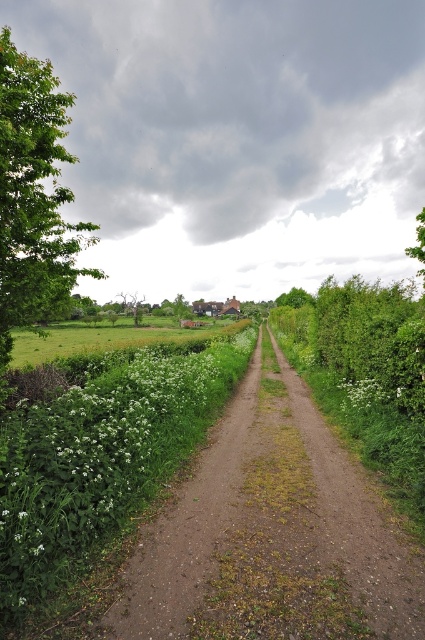
Can you confirm if dirt path at center is taller than white fluffy flower at center?

Yes.

This screenshot has height=640, width=425. What do you see at coordinates (272, 532) in the screenshot? I see `dirt path at center` at bounding box center [272, 532].

Measure the distance between dirt path at center and camera.

dirt path at center and camera are 7.74 meters apart from each other.

Identify the location of dirt path at center. This screenshot has width=425, height=640. (272, 532).

How much distance is there between dirt path at center and green grassy field at center?

A distance of 70.51 meters exists between dirt path at center and green grassy field at center.

Which is more to the right, dirt path at center or green grassy field at center?

From the viewer's perspective, dirt path at center appears more on the right side.

Who is more distant from viewer, (379, 506) or (172, 337)?

Point (172, 337)

Identify the location of dirt path at center. This screenshot has width=425, height=640. (272, 532).

Can you confirm if green grassy field at center is positioned below white fluffy flower at center?

No, green grassy field at center is not below white fluffy flower at center.

Which of these two, green grassy field at center or white fluffy flower at center, stands shorter?

Standing shorter between the two is white fluffy flower at center.

Identify the location of green grassy field at center. (110, 339).